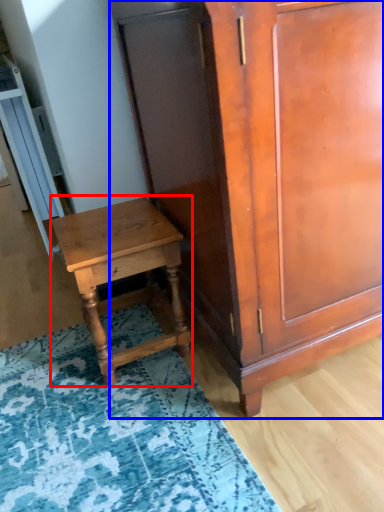
Question: Which point is closer to the camera, nightstand (highlighted by a red box) or cabinetry (highlighted by a blue box)?

Choices:
 (A) nightstand
 (B) cabinetry

Answer: (B)